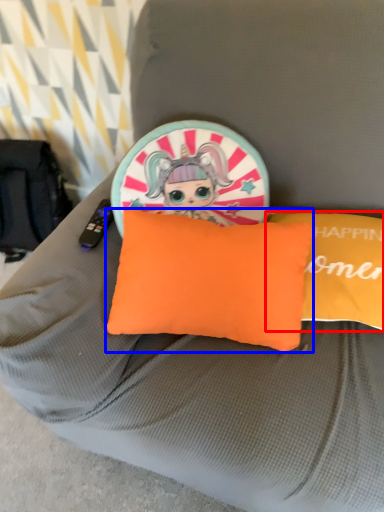
Question: Which of the following is the closest to the observer, pillow (highlighted by a red box) or pillow (highlighted by a blue box)?

Choices:
 (A) pillow
 (B) pillow

Answer: (B)